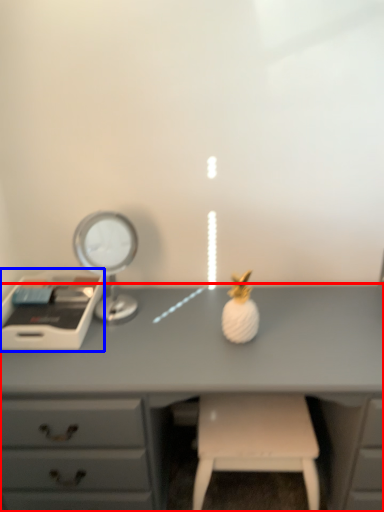
Question: Which object is closer to the camera taking this photo, desk (highlighted by a red box) or writing desk (highlighted by a blue box)?

Choices:
 (A) desk
 (B) writing desk

Answer: (A)